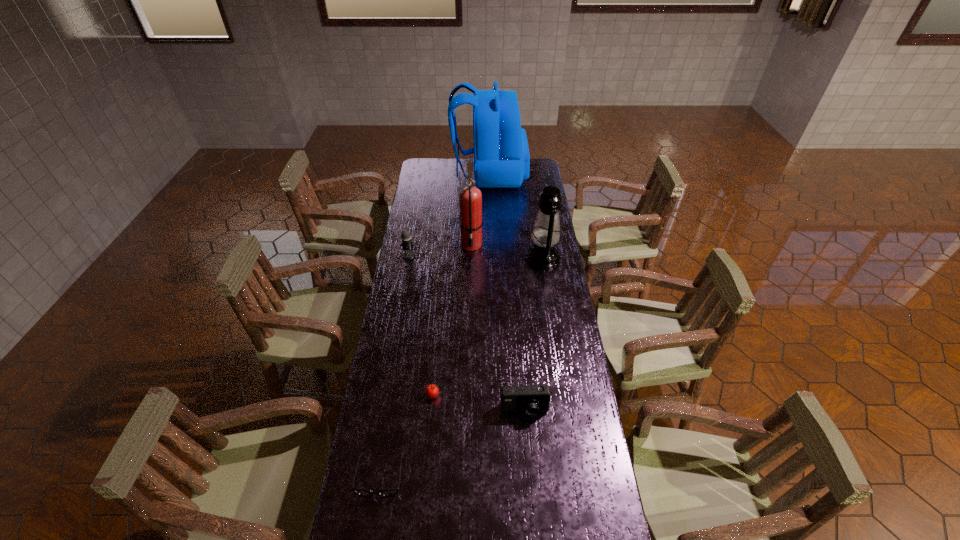
Locate an element on the screen. Image resolution: width=960 pixels, height=540 pixels. vacant point located on the back of the farthest object is located at coordinates (443, 174).

I want to click on vacant point located 0.090m on the back of the farthest object, so click(x=436, y=174).

Where is `vacant space located on the hose direction of the fire extinguisher`? vacant space located on the hose direction of the fire extinguisher is located at coordinates (x=470, y=308).

At what (x,y) coordinates should I click in order to perform the action: click on vacant position located 0.370m on the left of the oil lamp. Please return your answer as a coordinate pair (x, y). This screenshot has height=540, width=960. Looking at the image, I should click on (444, 258).

The height and width of the screenshot is (540, 960). Identify the location of free space located 0.340m on the right of the fourth tallest object. (490, 255).

Locate an element on the screen. This screenshot has width=960, height=540. vacant region located 0.220m on the front-facing side of the camera is located at coordinates (531, 491).

Locate an element on the screen. Image resolution: width=960 pixels, height=540 pixels. free space located on the front of the cherry is located at coordinates (425, 485).

This screenshot has width=960, height=540. In order to click on vacant space located on the front-facing side of the nearest object in this screenshot , I will do `click(371, 537)`.

Where is `object that is at the far edge`? object that is at the far edge is located at coordinates (501, 154).

Identify the location of microphone located at the left edge. This screenshot has height=540, width=960. (407, 244).